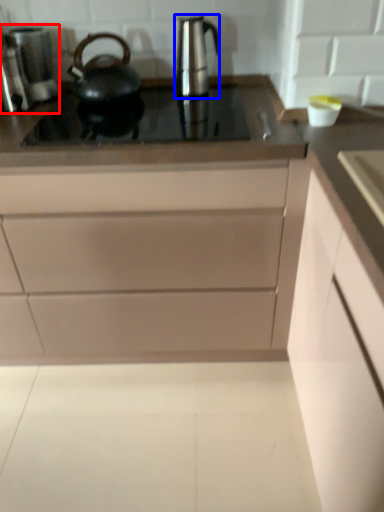
Question: Which object is further to the camera taking this photo, coffee machine (highlighted by a red box) or kitchen appliance (highlighted by a blue box)?

Choices:
 (A) coffee machine
 (B) kitchen appliance

Answer: (A)